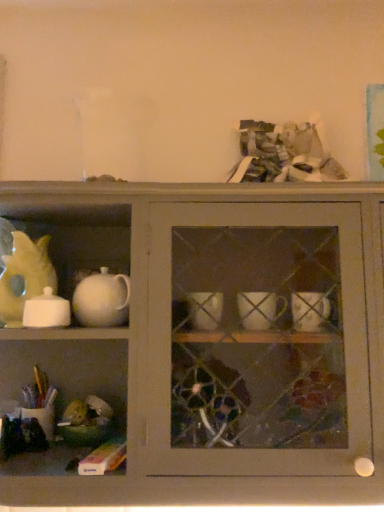
Question: Is white glossy sugar bowl at left to the left or to the right of yellow matte teapot at left in the image?

Choices:
 (A) left
 (B) right

Answer: (B)

Question: Does point (41, 326) appear closer or farther from the camera than point (44, 250)?

Choices:
 (A) closer
 (B) farther

Answer: (A)

Question: Based on their relative distances, which object is farther from the white glossy teapot at upper left?

Choices:
 (A) yellow matte teapot at left
 (B) white glossy sugar bowl at left

Answer: (A)

Question: Which object is positioned closest to the white glossy sugar bowl at left?

Choices:
 (A) yellow matte teapot at left
 (B) white glossy teapot at upper left

Answer: (A)